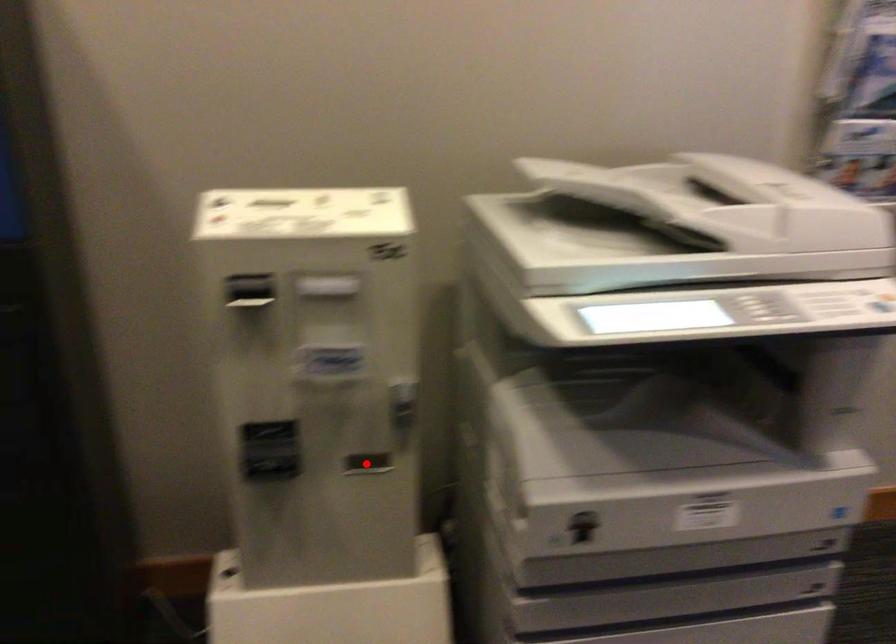
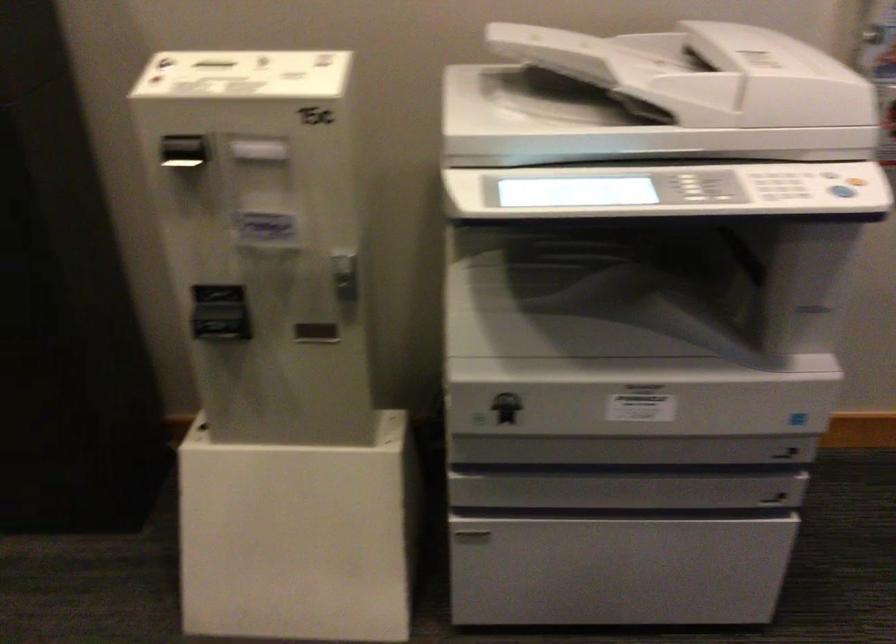
Question: I am providing you with two images of the same scene from different viewpoints. A red point is marked on the first image. Is the red point's position out of view in image 2?

Choices:
 (A) Yes
 (B) No

Answer: (B)